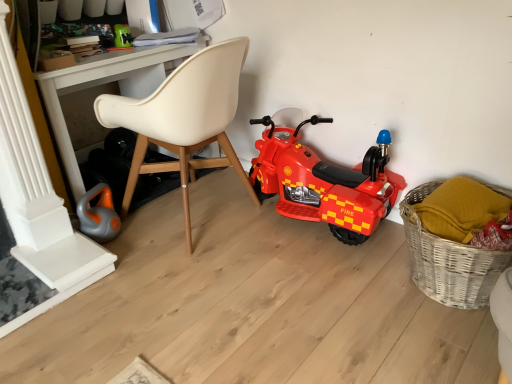
Locate an element on the screen. Image resolution: width=512 pixels, height=384 pixels. vacant space in between orange rubber toy at lower left, the first toy when ordered from front to back, and red plastic toy motorcycle at center is located at coordinates (219, 230).